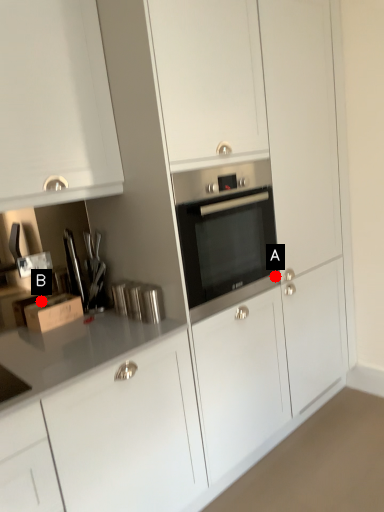
Question: Two points are circled on the image, labeled by A and B beside each circle. Which point appears closest to the camera in this image?

Choices:
 (A) A is closer
 (B) B is closer

Answer: (B)